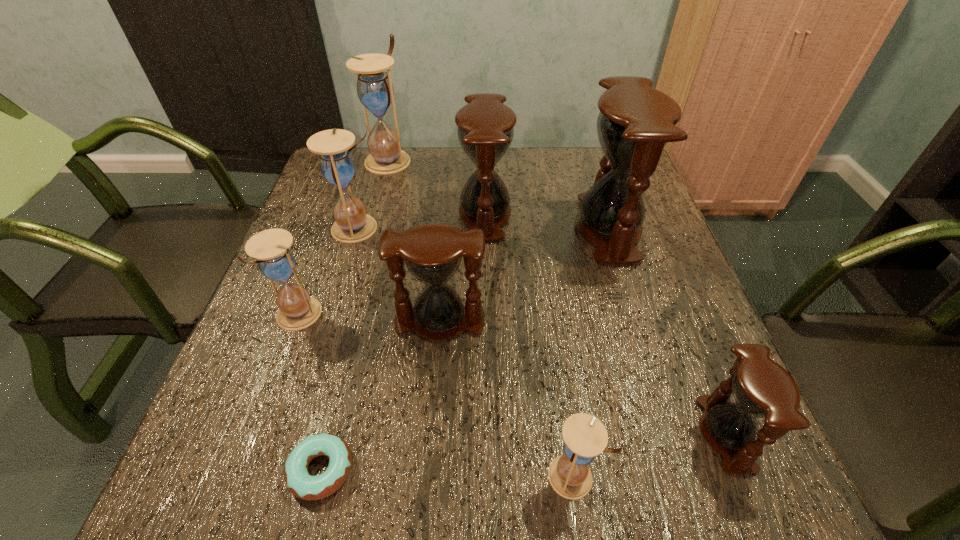
Image resolution: width=960 pixels, height=540 pixels. What are the coordinates of `object that ranks as the fifth closest to the shortest object` in the screenshot? It's located at (485, 130).

Locate an element on the screen. Image resolution: width=960 pixels, height=540 pixels. hourglass that is the sixth closest one to the second nearest brown hourglass is located at coordinates (761, 388).

At what (x,y) coordinates should I click in order to perform the action: click on hourglass that is the third nearest to the biggest brown hourglass. Please return your answer as a coordinate pair (x, y). The height and width of the screenshot is (540, 960). Looking at the image, I should click on [761, 388].

Identify the location of white hourglass that stands as the third closest to the smallest brown hourglass. Image resolution: width=960 pixels, height=540 pixels. (337, 165).

Find the location of a particular element. white hourglass that stands as the second closest to the second nearest white hourglass is located at coordinates (375, 90).

Find the location of a particular element. The image size is (960, 540). brown hourglass that is the second closest one to the farthest object is located at coordinates (635, 123).

Where is `the closest brown hourglass to the third smallest brown hourglass`? The height and width of the screenshot is (540, 960). the closest brown hourglass to the third smallest brown hourglass is located at coordinates (635, 123).

The height and width of the screenshot is (540, 960). Find the location of `vacant position in the image that satisfies the following two spatial constraints: 1. on the front side of the blue doughnut; 2. on the left side of the nearest white hourglass`. vacant position in the image that satisfies the following two spatial constraints: 1. on the front side of the blue doughnut; 2. on the left side of the nearest white hourglass is located at coordinates (320, 476).

Identify the location of free spot that satisfies the following two spatial constraints: 1. on the back side of the farthest hourglass; 2. on the left side of the second farthest white hourglass. Image resolution: width=960 pixels, height=540 pixels. (379, 160).

The width and height of the screenshot is (960, 540). Find the location of `blank space that satisfies the following two spatial constraints: 1. on the back side of the second biggest brown hourglass; 2. on the left side of the second farthest white hourglass`. blank space that satisfies the following two spatial constraints: 1. on the back side of the second biggest brown hourglass; 2. on the left side of the second farthest white hourglass is located at coordinates (363, 214).